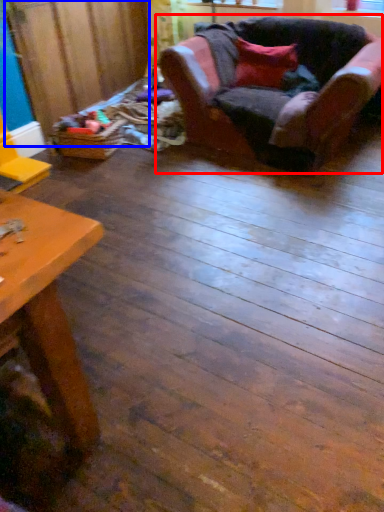
Question: Among these objects, which one is nearest to the camera, chair (highlighted by a red box) or plywood (highlighted by a blue box)?

Choices:
 (A) chair
 (B) plywood

Answer: (A)